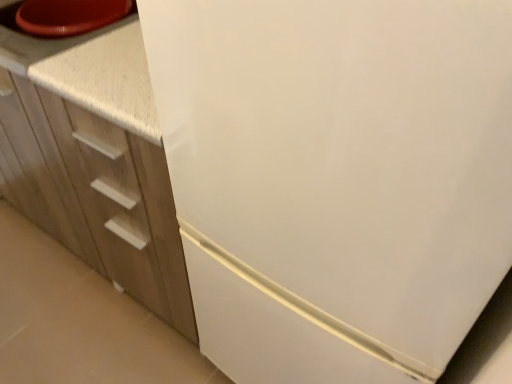
Question: Can you confirm if white speckled countertop at upper left is positioned to the right of white matte cabinet at left?

Choices:
 (A) no
 (B) yes

Answer: (A)

Question: From a real-world perspective, is white speckled countertop at upper left over white matte cabinet at left?

Choices:
 (A) yes
 (B) no

Answer: (A)

Question: Is white speckled countertop at upper left further to camera compared to white matte cabinet at left?

Choices:
 (A) yes
 (B) no

Answer: (A)

Question: Does white speckled countertop at upper left lie in front of white matte cabinet at left?

Choices:
 (A) no
 (B) yes

Answer: (A)

Question: Does white speckled countertop at upper left have a lesser width compared to white matte cabinet at left?

Choices:
 (A) no
 (B) yes

Answer: (B)

Question: Is white speckled countertop at upper left bigger than white matte cabinet at left?

Choices:
 (A) yes
 (B) no

Answer: (B)

Question: Is white matte cabinet at left smaller than white speckled countertop at upper left?

Choices:
 (A) no
 (B) yes

Answer: (A)

Question: Is white speckled countertop at upper left completely or partially inside white matte cabinet at left?

Choices:
 (A) yes
 (B) no

Answer: (A)

Question: Is white matte cabinet at left facing away from white speckled countertop at upper left?

Choices:
 (A) no
 (B) yes

Answer: (A)

Question: Can you confirm if white matte cabinet at left is wider than white speckled countertop at upper left?

Choices:
 (A) yes
 (B) no

Answer: (A)

Question: Does white matte cabinet at left have a greater height compared to white speckled countertop at upper left?

Choices:
 (A) no
 (B) yes

Answer: (B)

Question: Is white matte cabinet at left in contact with white speckled countertop at upper left?

Choices:
 (A) yes
 (B) no

Answer: (B)

Question: Relative to white matte cabinet at left, is white speckled countertop at upper left in front or behind?

Choices:
 (A) front
 (B) behind

Answer: (B)